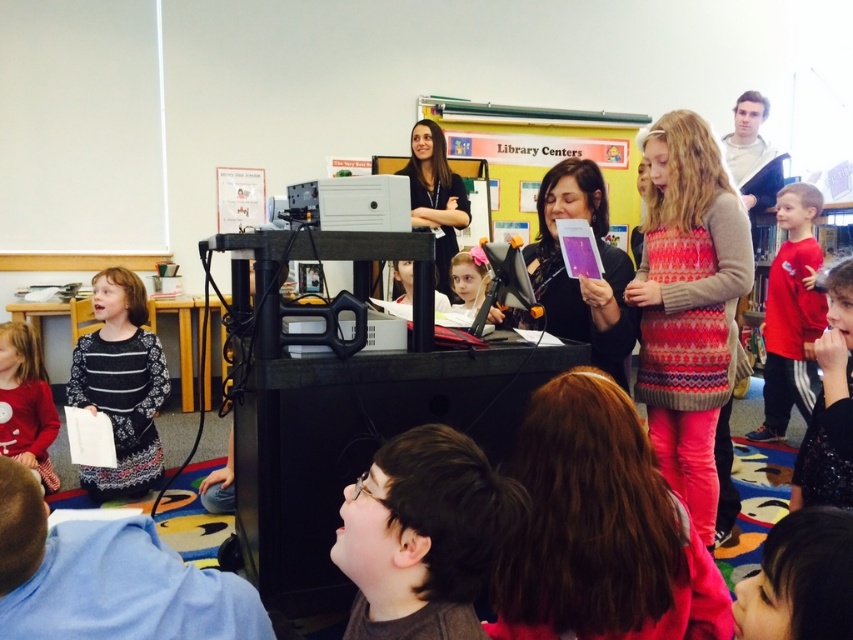
From the picture: Does striped fabric dress at lower left have a lesser height compared to red cotton shirt at right?

Indeed, striped fabric dress at lower left has a lesser height compared to red cotton shirt at right.

Is point (106, 312) farther from camera compared to point (796, 195)?

No, it is not.

This screenshot has height=640, width=853. I want to click on striped fabric dress at lower left, so click(x=120, y=385).

Can you confirm if shiny pink sweater at center is thinner than pink fabric dress at center?

Incorrect, shiny pink sweater at center's width is not less than pink fabric dress at center's.

Is shiny pink sweater at center wider than pink fabric dress at center?

Yes, shiny pink sweater at center is wider than pink fabric dress at center.

This screenshot has height=640, width=853. What do you see at coordinates (601, 529) in the screenshot? I see `shiny pink sweater at center` at bounding box center [601, 529].

Locate an element on the screen. shiny pink sweater at center is located at coordinates (601, 529).

Is striped fabric dress at lower left to the right of dark brown hair at center from the viewer's perspective?

Incorrect, striped fabric dress at lower left is not on the right side of dark brown hair at center.

Is point (102, 406) farther from camera compared to point (444, 141)?

That is False.

Is point (140, 408) positioned before point (440, 209)?

Yes, point (140, 408) is closer to viewer.

The height and width of the screenshot is (640, 853). I want to click on striped fabric dress at lower left, so 120,385.